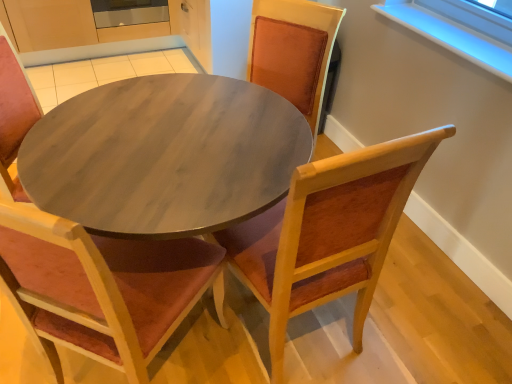
Question: Which is correct: wooden chair at center, acting as the 2th chair starting from the left, is inside wooden chair with velvet cushion at center, arranged as the 2th chair when viewed from the right, or outside of it?

Choices:
 (A) outside
 (B) inside

Answer: (A)

Question: In terms of width, does wooden chair at center, which ranks as the 1th chair in right-to-left order, look wider or thinner when compared to wooden chair with velvet cushion at center, acting as the first chair starting from the left?

Choices:
 (A) wide
 (B) thin

Answer: (B)

Question: Considering the positions of point (260, 226) and point (0, 168), is point (260, 226) closer or farther from the camera than point (0, 168)?

Choices:
 (A) closer
 (B) farther

Answer: (B)

Question: From the image's perspective, relative to wooden chair at center, acting as the 2th chair starting from the left, is wooden chair with velvet cushion at center, acting as the first chair starting from the left, above or below?

Choices:
 (A) below
 (B) above

Answer: (A)

Question: Looking at their shapes, would you say wooden chair with velvet cushion at center, acting as the first chair starting from the left, is wider or thinner than wooden chair at center, acting as the 2th chair starting from the left?

Choices:
 (A) wide
 (B) thin

Answer: (A)

Question: Is wooden chair with velvet cushion at center, arranged as the 2th chair when viewed from the right, in front of or behind wooden chair at center, which ranks as the 1th chair in right-to-left order, in the image?

Choices:
 (A) behind
 (B) front

Answer: (B)

Question: From their relative heights in the image, would you say wooden chair with velvet cushion at center, arranged as the 2th chair when viewed from the right, is taller or shorter than wooden chair at center, which ranks as the 1th chair in right-to-left order?

Choices:
 (A) tall
 (B) short

Answer: (A)